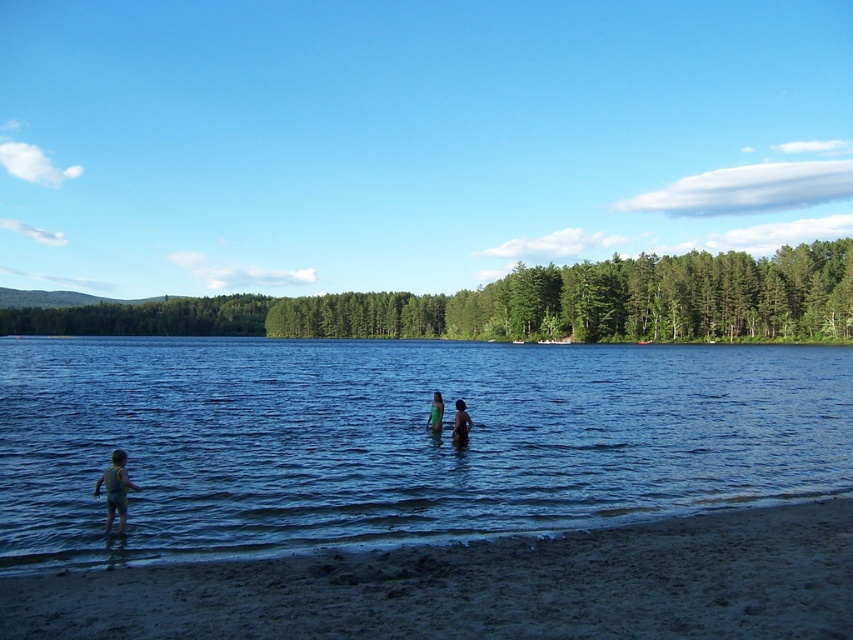
Question: Can you confirm if dark blue swimsuit at lower left is positioned below green fabric at center?

Choices:
 (A) no
 (B) yes

Answer: (B)

Question: Which point is closer to the camera?

Choices:
 (A) dark blue swimsuit at lower left
 (B) smooth skin person at center
 (C) dark sand at lower left
 (D) green fabric at center

Answer: (C)

Question: Does dark sand at lower left appear on the left side of smooth skin person at center?

Choices:
 (A) no
 (B) yes

Answer: (A)

Question: Among these objects, which one is farthest from the camera?

Choices:
 (A) dark blue swimsuit at lower left
 (B) smooth skin person at center
 (C) green fabric at center

Answer: (C)

Question: Is dark sand at lower left thinner than smooth skin person at center?

Choices:
 (A) no
 (B) yes

Answer: (A)

Question: Which is farther from the blue liquid water at center?

Choices:
 (A) green fabric at center
 (B) dark sand at lower left
 (C) smooth skin person at center
 (D) dark blue swimsuit at lower left

Answer: (D)